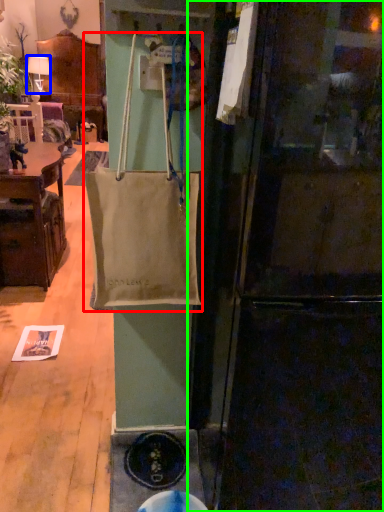
Question: Which object is the closest to the handbag (highlighted by a red box)? Choose among these: lamp (highlighted by a blue box) or refrigerator (highlighted by a green box).

Choices:
 (A) lamp
 (B) refrigerator

Answer: (B)